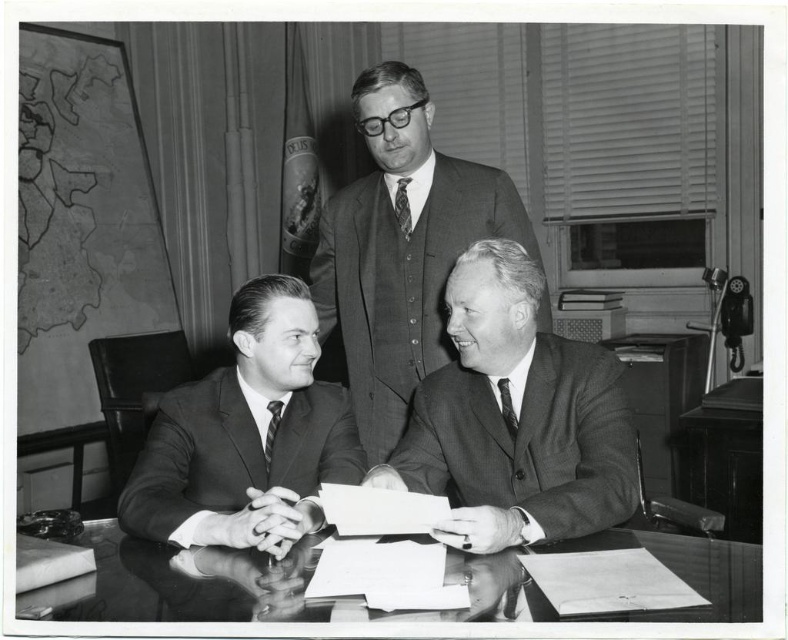
Question: Which point is farther to the camera?

Choices:
 (A) dark gray suit at center
 (B) dark gray textured tie at center
 (C) smooth suit at center
 (D) smooth gray suit at center

Answer: (D)

Question: Does smooth suit at center appear on the right side of smooth gray suit at center?

Choices:
 (A) yes
 (B) no

Answer: (A)

Question: Which point is farther from the camera taking this photo?

Choices:
 (A) (443, 262)
 (B) (266, 433)
 (C) (409, 227)
 (D) (690, 577)

Answer: (C)

Question: Can you confirm if dark gray suit at center is smaller than glossy wood table at center?

Choices:
 (A) no
 (B) yes

Answer: (A)

Question: Which of the following is the closest to the observer?

Choices:
 (A) glossy wood table at center
 (B) textured silk tie at upper center

Answer: (A)

Question: Does smooth gray suit at center lie behind glossy wood table at center?

Choices:
 (A) no
 (B) yes

Answer: (B)